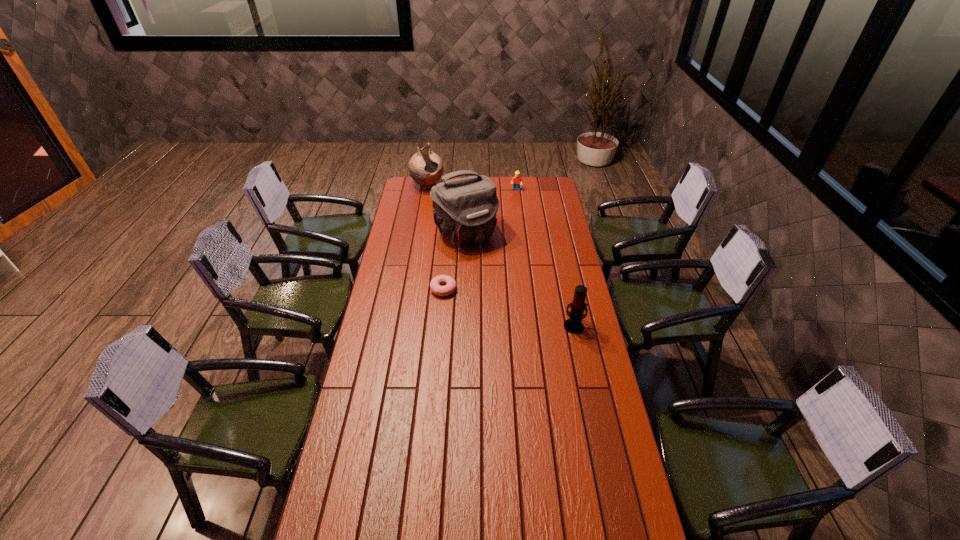
At what (x,y) coordinates should I click in order to perform the action: click on Lego located in the far edge section of the desktop. Please return your answer as a coordinate pair (x, y). Image resolution: width=960 pixels, height=540 pixels. Looking at the image, I should click on pos(517,180).

Find the location of a particular element. pottery positioned at the far edge is located at coordinates (425, 167).

You are a GUI agent. You are given a task and a screenshot of the screen. Output one action in this format:
    pyautogui.click(x=<x>, y=<y>)
    Task: Click on the object that is at the left edge
    This screenshot has height=540, width=960.
    Given the screenshot: What is the action you would take?
    pyautogui.click(x=425, y=167)

Find the location of a particular element. Image resolution: width=960 pixels, height=540 pixels. object that is at the right edge is located at coordinates (573, 325).

Find the location of `object that is at the far left corner`. object that is at the far left corner is located at coordinates (425, 167).

The width and height of the screenshot is (960, 540). I want to click on blank space at the far edge of the desktop, so click(495, 178).

At what (x,y) coordinates should I click in order to perform the action: click on free spot at the near edge of the desktop. Please return your answer as a coordinate pair (x, y). The height and width of the screenshot is (540, 960). Looking at the image, I should click on (430, 526).

The image size is (960, 540). Find the location of `vacant position at the left edge of the desktop`. vacant position at the left edge of the desktop is located at coordinates (391, 291).

The height and width of the screenshot is (540, 960). In the image, there is a desktop. Find the location of `free space at the right edge`. free space at the right edge is located at coordinates (554, 294).

Image resolution: width=960 pixels, height=540 pixels. Identify the location of vacant space at the far left corner. (407, 178).